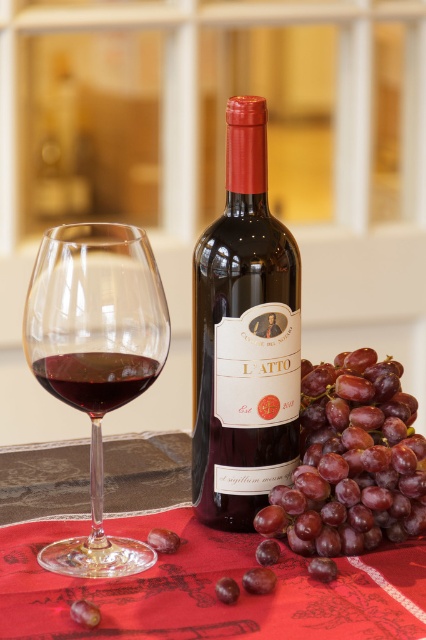
Question: Which of the following is the farthest from the observer?

Choices:
 (A) (336, 452)
 (B) (144, 387)
 (C) (137, 340)

Answer: (A)

Question: Does matte glass bottle at center appear on the right side of shiny purple grapes at center-right?

Choices:
 (A) no
 (B) yes

Answer: (A)

Question: Where is matte glass bottle at center located in relation to red glass at center in the image?

Choices:
 (A) above
 (B) below

Answer: (A)

Question: Which object is farther from the camera taking this photo?

Choices:
 (A) shiny purple grapes at center-right
 (B) transparent glass at left
 (C) red glass at center
 (D) matte glass bottle at center

Answer: (D)

Question: Is matte glass bottle at center bigger than transparent glass at left?

Choices:
 (A) no
 (B) yes

Answer: (A)

Question: Among these objects, which one is farthest from the camera?

Choices:
 (A) shiny purple grapes at center-right
 (B) matte glass bottle at center

Answer: (B)